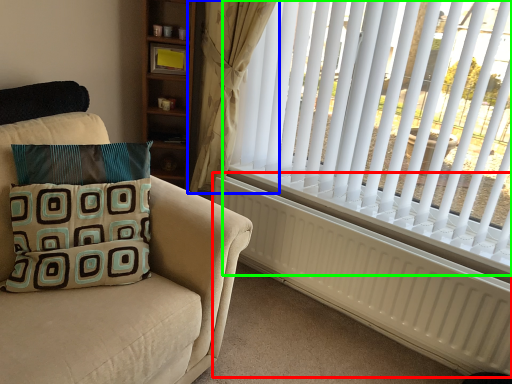
Question: Considering the real-world distances, which object is farthest from radiator (highlighted by a red box)? curtain (highlighted by a blue box) or window blind (highlighted by a green box)?

Choices:
 (A) curtain
 (B) window blind

Answer: (A)